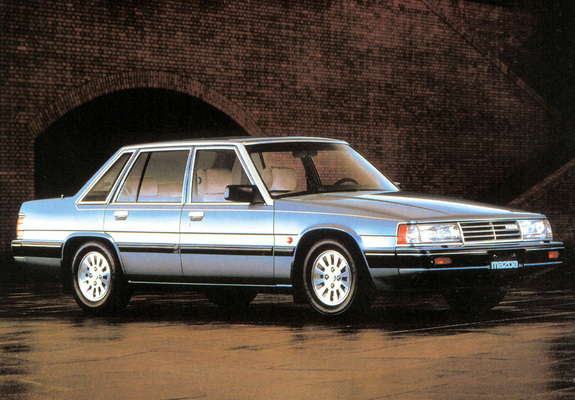
At what (x,y) coordinates should I click in order to perform the action: click on floor. Please return your answer as a coordinate pair (x, y). Looking at the image, I should click on (244, 351).